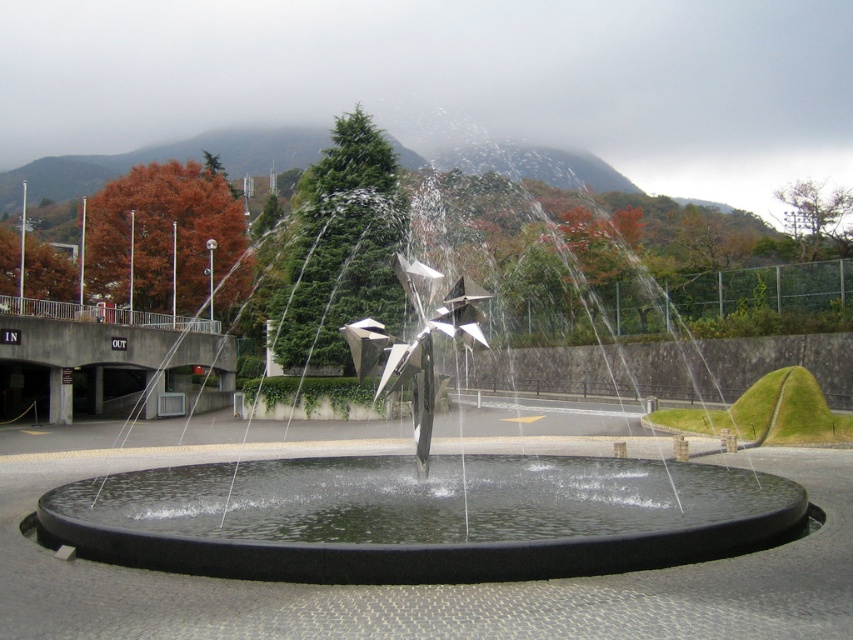
Is polished metal fountain at center thinner than black polished water at center?

In fact, polished metal fountain at center might be wider than black polished water at center.

Image resolution: width=853 pixels, height=640 pixels. I want to click on polished metal fountain at center, so click(x=421, y=515).

Is polished metal fountain at center wider than metallic sculpture at center?

Yes.

Can you confirm if polished metal fountain at center is shorter than metallic sculpture at center?

No.

Between point (357, 563) and point (401, 273), which one is positioned in front?

Point (357, 563)

In order to click on polished metal fountain at center in this screenshot , I will do `click(421, 515)`.

Can you confirm if black polished water at center is positioned to the right of metallic sculpture at center?

Correct, you'll find black polished water at center to the right of metallic sculpture at center.

Can you confirm if black polished water at center is positioned to the left of metallic sculpture at center?

No, black polished water at center is not to the left of metallic sculpture at center.

Between point (161, 470) and point (363, 342), which one is positioned in front?

Positioned in front is point (363, 342).

This screenshot has width=853, height=640. I want to click on black polished water at center, so click(421, 516).